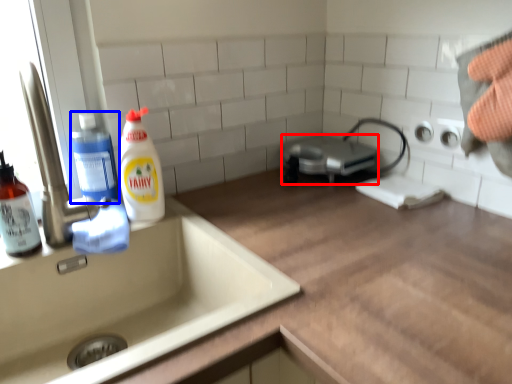
Question: Which object appears farthest to the camera in this image, appliance (highlighted by a red box) or cleaning product (highlighted by a blue box)?

Choices:
 (A) appliance
 (B) cleaning product

Answer: (A)